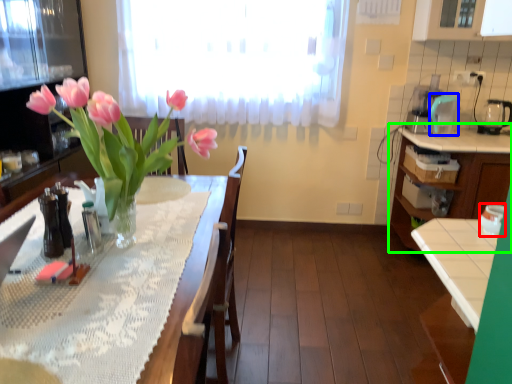
Question: Considering the real-world distances, which object is closest to appliance (highlighted by a red box)? appliance (highlighted by a blue box) or cabinetry (highlighted by a green box).

Choices:
 (A) appliance
 (B) cabinetry

Answer: (B)